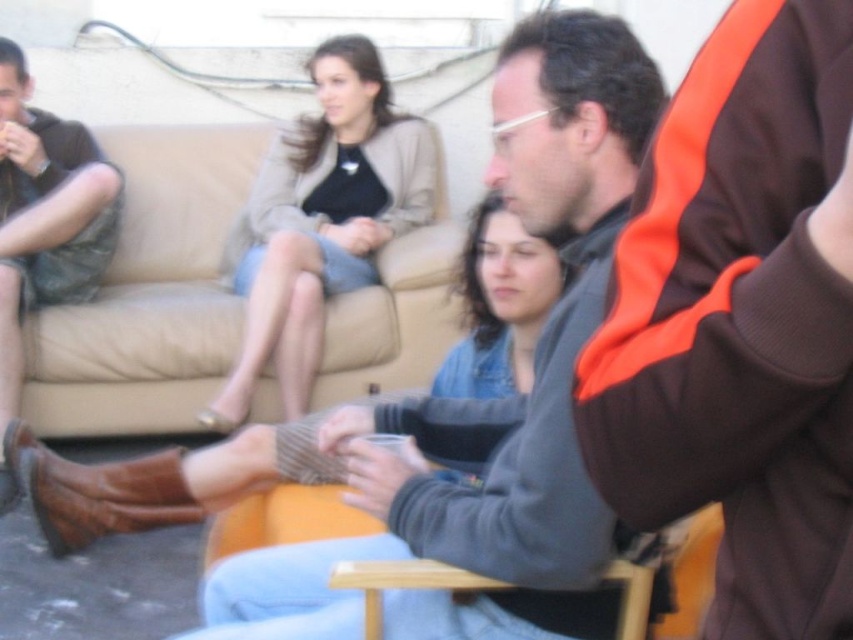
In the scene shown: You are standing in the outdoor setting shown. There are two points marked in the image. The first point is at coordinates point (53, 294) and the second is at point (463, 576). Which point is closer to you?

Point (53, 294) is closer to you because it is further to the viewer than point (463, 576).

You are standing in the scene and want to take a photo of the beige fabric couch at upper center using a camera that has a minimum focusing distance of 10 feet. Can you take the photo without moving closer?

The beige fabric couch at upper center and camera are 10.12 feet apart. Since the minimum focusing distance is 10 feet, you can take the photo without moving closer because the distance is sufficient.